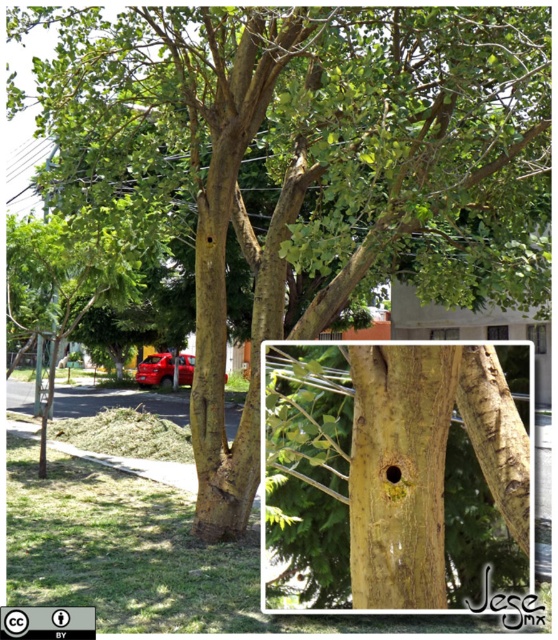
You are a delivery person trying to locate a house marked by a tree with a yellow rough bark hole. You see the glossy red car at center and the yellow rough bark hole at center. Which object is located to the right of the other?

The yellow rough bark hole at center is positioned on the right side of the glossy red car at center.

Looking at this image, you are a painter planning to paint the tree and the car in the scene. You have a limited amount of paint. Which object, the yellow rough bark hole at center or the glossy red car at center, would require more paint to cover its visible area?

The glossy red car at center requires more paint because it occupies more space than the yellow rough bark hole at center.